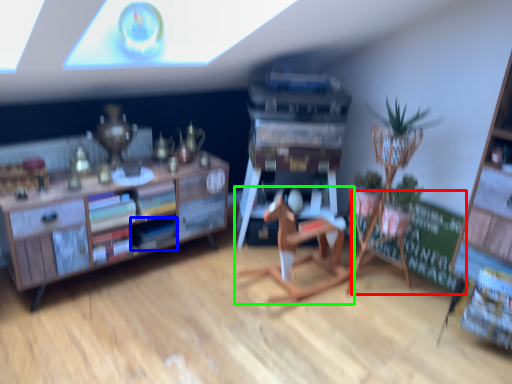
Question: Estimate the real-world distances between objects in this image. Which object is closer to bulletin board (highlighted by a red box), book (highlighted by a blue box) or chair (highlighted by a green box)?

Choices:
 (A) book
 (B) chair

Answer: (B)